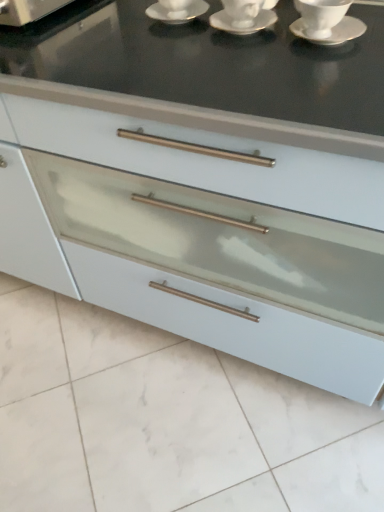
Measure the distance between white glossy saucer at upper right, which ranks as the first saucer in right-to-left order, and camera.

They are 81.78 centimeters apart.

What do you see at coordinates (243, 28) in the screenshot?
I see `white ceramic saucer at center, the 2th saucer in the left-to-right sequence` at bounding box center [243, 28].

The width and height of the screenshot is (384, 512). I want to click on white ceramic cup at upper right, so click(319, 17).

What is the approximate width of white ceramic cup at upper right?

white ceramic cup at upper right is 4.41 inches wide.

At what (x,y) coordinates should I click in order to perform the action: click on white glossy saucer at upper right, which ranks as the first saucer in right-to-left order. Please return your answer as a coordinate pair (x, y). The width and height of the screenshot is (384, 512). Looking at the image, I should click on (x=332, y=31).

Does white glossy saucer at upper right, the third saucer from the left, have a greater height compared to white ceramic saucer at center, the 2th saucer in the left-to-right sequence?

In fact, white glossy saucer at upper right, the third saucer from the left, may be shorter than white ceramic saucer at center, the 2th saucer in the left-to-right sequence.

Could you tell me if white glossy saucer at upper right, the third saucer from the left, is turned towards white ceramic saucer at center, the second saucer when ordered from right to left?

No, white glossy saucer at upper right, the third saucer from the left, is not oriented towards white ceramic saucer at center, the second saucer when ordered from right to left.

From the image's perspective, which one is positioned lower, white glossy saucer at upper right, the third saucer from the left, or white ceramic saucer at center, the 2th saucer in the left-to-right sequence?

white glossy saucer at upper right, the third saucer from the left, is shown below in the image.

Which is more to the left, white glossy saucer at upper right, which ranks as the first saucer in right-to-left order, or white ceramic saucer at upper center, which is the third saucer from right to left?

From the viewer's perspective, white ceramic saucer at upper center, which is the third saucer from right to left, appears more on the left side.

Which object is further away from the camera, white glossy saucer at upper right, which ranks as the first saucer in right-to-left order, or white ceramic saucer at upper center, the 1th saucer from the left?

white ceramic saucer at upper center, the 1th saucer from the left.

Can you confirm if white glossy saucer at upper right, the third saucer from the left, is taller than white ceramic saucer at upper center, the 1th saucer from the left?

No.

Locate an element on the screen. the 2nd saucer below when counting from the white ceramic saucer at upper center, the 1th saucer from the left (from the image's perspective) is located at coordinates (332, 31).

Can you confirm if white ceramic cup at upper right is positioned to the left of white ceramic saucer at upper center, which is the third saucer from right to left?

A: No, white ceramic cup at upper right is not to the left of white ceramic saucer at upper center, which is the third saucer from right to left.

Which point is more forward, (316, 6) or (162, 21)?

The point (316, 6) is closer.

What's the angular difference between white ceramic cup at upper right and white ceramic saucer at upper center, the 1th saucer from the left,'s facing directions?

0.816 degrees.

Is white ceramic saucer at upper center, the 1th saucer from the left, positioned in front of white glossy saucer at upper right, the third saucer from the left?

No, it is behind white glossy saucer at upper right, the third saucer from the left.

Would you consider white ceramic saucer at upper center, the 1th saucer from the left, to be distant from white glossy saucer at upper right, which ranks as the first saucer in right-to-left order?

white ceramic saucer at upper center, the 1th saucer from the left, is near white glossy saucer at upper right, which ranks as the first saucer in right-to-left order, not far away.

From a real-world perspective, is white ceramic saucer at upper center, the 1th saucer from the left, below white glossy saucer at upper right, the third saucer from the left?

Incorrect, from a real-world perspective, white ceramic saucer at upper center, the 1th saucer from the left, is higher than white glossy saucer at upper right, the third saucer from the left.

Between white ceramic cup at upper right and white glossy saucer at upper right, the third saucer from the left, which one has larger width?

white glossy saucer at upper right, the third saucer from the left, is wider.

I want to click on tableware lying on the left of white glossy saucer at upper right, the third saucer from the left, so click(319, 17).

Is point (339, 9) less distant than point (357, 27)?

Yes.

From the image's perspective, which one is positioned lower, white ceramic cup at upper right or white glossy saucer at upper right, the third saucer from the left?

From the image's view, white glossy saucer at upper right, the third saucer from the left, is below.

Is white ceramic saucer at upper center, which is the third saucer from right to left, facing away from white ceramic cup at upper right?

No, white ceramic saucer at upper center, which is the third saucer from right to left, is not facing the opposite direction of white ceramic cup at upper right.

Is white ceramic saucer at upper center, the 1th saucer from the left, closer to camera compared to white ceramic cup at upper right?

No, white ceramic saucer at upper center, the 1th saucer from the left, is behind white ceramic cup at upper right.

From a real-world perspective, does white ceramic saucer at upper center, the 1th saucer from the left, sit lower than white ceramic cup at upper right?

Actually, white ceramic saucer at upper center, the 1th saucer from the left, is physically above white ceramic cup at upper right in the real world.

Is white ceramic saucer at upper center, which is the third saucer from right to left, next to white ceramic cup at upper right?

white ceramic saucer at upper center, which is the third saucer from right to left, and white ceramic cup at upper right are not in contact.

In the scene shown: Which object is further away from the camera, white ceramic cup at upper right or white ceramic saucer at center, the second saucer when ordered from right to left?

white ceramic saucer at center, the second saucer when ordered from right to left, is more distant.

Measure the distance from white ceramic cup at upper right to white ceramic saucer at center, the 2th saucer in the left-to-right sequence.

They are 4.55 inches apart.

In the scene shown: Considering the sizes of objects white ceramic cup at upper right and white ceramic saucer at center, the 2th saucer in the left-to-right sequence, in the image provided, who is thinner, white ceramic cup at upper right or white ceramic saucer at center, the 2th saucer in the left-to-right sequence,?

Thinner between the two is white ceramic cup at upper right.

Is white ceramic cup at upper right positioned with its back to white ceramic saucer at center, the 2th saucer in the left-to-right sequence?

No, white ceramic cup at upper right's orientation is not away from white ceramic saucer at center, the 2th saucer in the left-to-right sequence.

The height and width of the screenshot is (512, 384). In order to click on saucer below the white ceramic saucer at center, the 2th saucer in the left-to-right sequence (from a real-world perspective) in this screenshot , I will do click(332, 31).

Find the location of a particular element. The height and width of the screenshot is (512, 384). the 2nd saucer above when counting from the white glossy saucer at upper right, the third saucer from the left (from the image's perspective) is located at coordinates (177, 11).

When comparing their distances from white ceramic saucer at center, the 2th saucer in the left-to-right sequence, does white ceramic cup at upper right or white glossy saucer at upper right, which ranks as the first saucer in right-to-left order, seem closer?

white ceramic cup at upper right is positioned closer to the anchor white ceramic saucer at center, the 2th saucer in the left-to-right sequence.

Considering their positions, is white ceramic saucer at upper center, which is the third saucer from right to left, positioned closer to white glossy saucer at upper right, the third saucer from the left, than white ceramic saucer at center, the second saucer when ordered from right to left?

white ceramic saucer at center, the second saucer when ordered from right to left, lies closer to white glossy saucer at upper right, the third saucer from the left, than the other object.

When comparing their distances from white glossy saucer at upper right, which ranks as the first saucer in right-to-left order, does white ceramic cup at upper right or white ceramic saucer at upper center, the 1th saucer from the left, seem closer?

white ceramic cup at upper right is closer to white glossy saucer at upper right, which ranks as the first saucer in right-to-left order.

Looking at the image, which one is located closer to white ceramic cup at upper right, white ceramic saucer at upper center, the 1th saucer from the left, or white glossy saucer at upper right, the third saucer from the left?

white glossy saucer at upper right, the third saucer from the left, is closer to white ceramic cup at upper right.

When comparing their distances from white glossy saucer at upper right, which ranks as the first saucer in right-to-left order, does white ceramic saucer at upper center, which is the third saucer from right to left, or white ceramic cup at upper right seem closer?

Based on the image, white ceramic cup at upper right appears to be nearer to white glossy saucer at upper right, which ranks as the first saucer in right-to-left order.

Considering their positions, is white ceramic saucer at center, the second saucer when ordered from right to left, positioned closer to white ceramic cup at upper right than white glossy saucer at upper right, which ranks as the first saucer in right-to-left order?

white glossy saucer at upper right, which ranks as the first saucer in right-to-left order, lies closer to white ceramic cup at upper right than the other object.

Estimate the real-world distances between objects in this image. Which object is closer to white ceramic saucer at center, the 2th saucer in the left-to-right sequence, white glossy saucer at upper right, which ranks as the first saucer in right-to-left order, or white ceramic cup at upper right?

The object closer to white ceramic saucer at center, the 2th saucer in the left-to-right sequence, is white ceramic cup at upper right.

When comparing their distances from white ceramic saucer at upper center, the 1th saucer from the left, does white glossy saucer at upper right, which ranks as the first saucer in right-to-left order, or white ceramic saucer at center, the second saucer when ordered from right to left, seem closer?

white ceramic saucer at center, the second saucer when ordered from right to left, is positioned closer to the anchor white ceramic saucer at upper center, the 1th saucer from the left.

The height and width of the screenshot is (512, 384). I want to click on saucer located between white ceramic saucer at upper center, the 1th saucer from the left, and white ceramic cup at upper right in the left-right direction, so click(x=243, y=28).

Where is `tableware between white ceramic saucer at center, the second saucer when ordered from right to left, and white glossy saucer at upper right, the third saucer from the left, from left to right`? Image resolution: width=384 pixels, height=512 pixels. tableware between white ceramic saucer at center, the second saucer when ordered from right to left, and white glossy saucer at upper right, the third saucer from the left, from left to right is located at coordinates (319, 17).

You are a GUI agent. You are given a task and a screenshot of the screen. Output one action in this format:
    pyautogui.click(x=<x>, y=<y>)
    Task: Click on the saucer situated between white ceramic saucer at upper center, the 1th saucer from the left, and white glossy saucer at upper right, which ranks as the first saucer in right-to-left order, from left to right
    The height and width of the screenshot is (512, 384).
    Given the screenshot: What is the action you would take?
    pyautogui.click(x=243, y=28)

Locate an element on the screen. The image size is (384, 512). tableware between white ceramic saucer at upper center, which is the third saucer from right to left, and white glossy saucer at upper right, which ranks as the first saucer in right-to-left order is located at coordinates (319, 17).